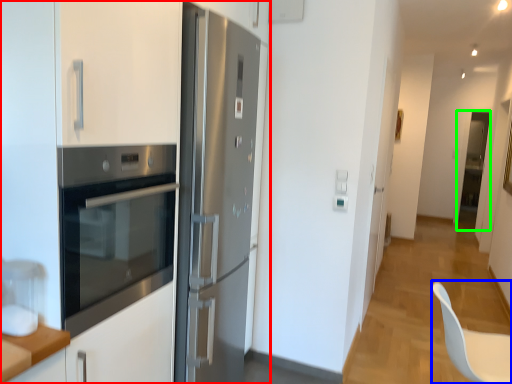
Question: Based on their relative distances, which object is farther from cabinetry (highlighted by a red box)? Choose from swivel chair (highlighted by a blue box) and glass door (highlighted by a green box).

Choices:
 (A) swivel chair
 (B) glass door

Answer: (B)